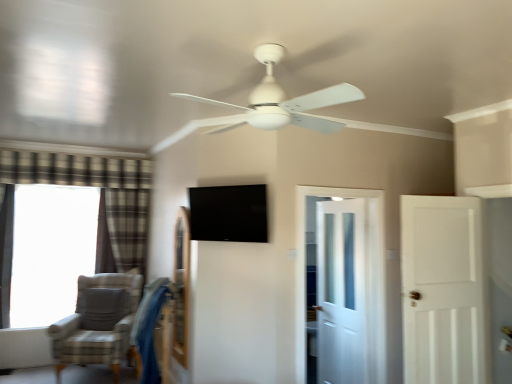
Question: Is plaid fabric curtain at left, the 2th curtain viewed from the front, thinner than blue fabric swivel chair at lower left?

Choices:
 (A) no
 (B) yes

Answer: (B)

Question: Could blue fabric swivel chair at lower left be considered to be inside plaid fabric curtain at left, arranged as the first curtain when viewed from the right?

Choices:
 (A) yes
 (B) no

Answer: (B)

Question: From the image's perspective, is plaid fabric curtain at left, positioned as the first curtain in back-to-front order, under blue fabric swivel chair at lower left?

Choices:
 (A) yes
 (B) no

Answer: (B)

Question: Is the surface of plaid fabric curtain at left, which is the second curtain from left to right, in direct contact with blue fabric swivel chair at lower left?

Choices:
 (A) no
 (B) yes

Answer: (A)

Question: Is plaid fabric curtain at left, which is the second curtain from left to right, positioned in front of blue fabric swivel chair at lower left?

Choices:
 (A) yes
 (B) no

Answer: (B)

Question: From a real-world perspective, is plaid fabric curtain at left, which is the second curtain from left to right, on top of blue fabric swivel chair at lower left?

Choices:
 (A) no
 (B) yes

Answer: (B)

Question: Does white matte ceiling fan at center contain plaid fabric curtain at left, positioned as the first curtain in back-to-front order?

Choices:
 (A) no
 (B) yes

Answer: (A)

Question: Is white matte ceiling fan at center outside plaid fabric curtain at left, arranged as the first curtain when viewed from the right?

Choices:
 (A) yes
 (B) no

Answer: (A)

Question: Is white matte ceiling fan at center with plaid fabric curtain at left, arranged as the first curtain when viewed from the right?

Choices:
 (A) no
 (B) yes

Answer: (A)

Question: Does white matte ceiling fan at center come in front of plaid fabric curtain at left, positioned as the first curtain in back-to-front order?

Choices:
 (A) yes
 (B) no

Answer: (A)

Question: From the image's perspective, is white matte ceiling fan at center below plaid fabric curtain at left, which is the second curtain from left to right?

Choices:
 (A) yes
 (B) no

Answer: (B)

Question: Does white matte ceiling fan at center have a lesser height compared to plaid fabric curtain at left, the 2th curtain viewed from the front?

Choices:
 (A) no
 (B) yes

Answer: (B)

Question: Considering the relative sizes of gray fabric chair at lower left and white matte door at right, which appears as the 1th door when viewed from the front, in the image provided, is gray fabric chair at lower left thinner than white matte door at right, which appears as the 1th door when viewed from the front,?

Choices:
 (A) yes
 (B) no

Answer: (B)